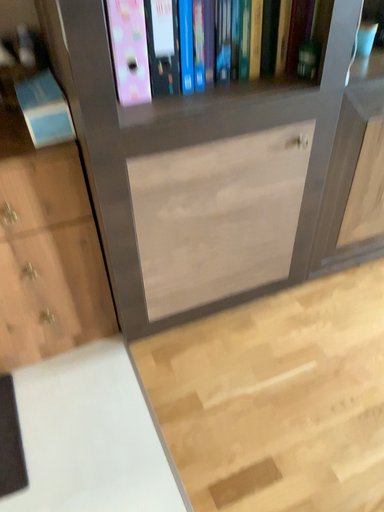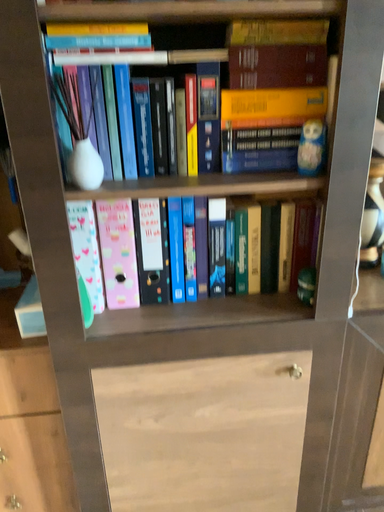
Question: Which way did the camera rotate in the video?

Choices:
 (A) rotated downward
 (B) rotated upward

Answer: (B)